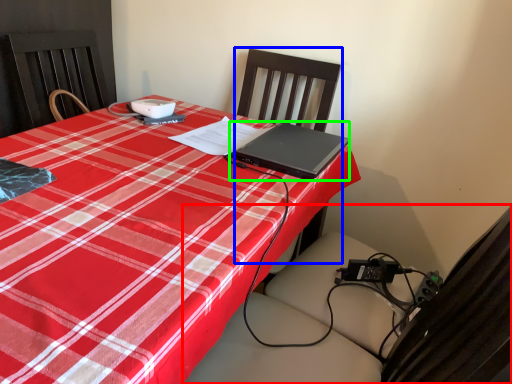
Question: Considering the real-world distances, which object is closest to swivel chair (highlighted by a red box)? chair (highlighted by a blue box) or laptop (highlighted by a green box).

Choices:
 (A) chair
 (B) laptop

Answer: (B)